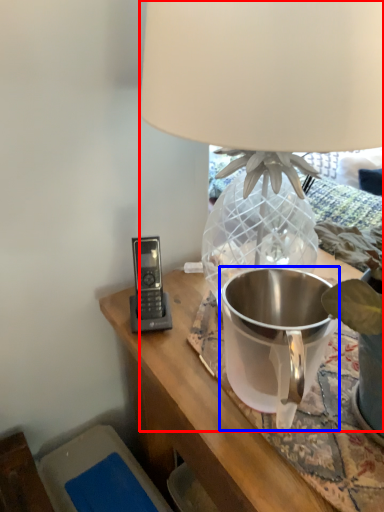
Question: Among these objects, which one is nearest to the camera, lamp (highlighted by a red box) or appliance (highlighted by a blue box)?

Choices:
 (A) lamp
 (B) appliance

Answer: (A)